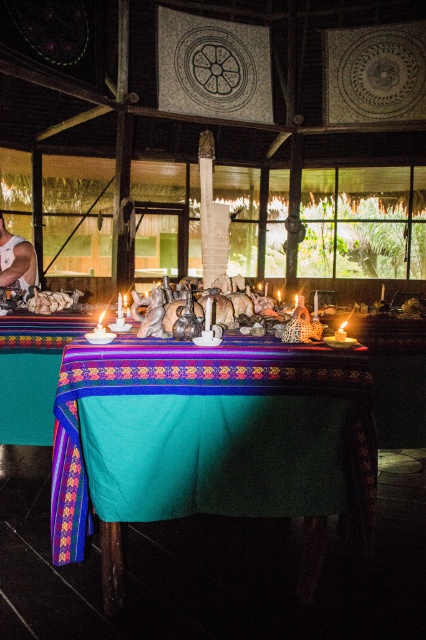
Is teal fabric table at center positioned behind muscular skin torso at lower left?

No, teal fabric table at center is closer to the viewer.

Between point (244, 419) and point (28, 273), which one is positioned behind?

The point (28, 273) is more distant.

Where is `teal fabric table at center`? The height and width of the screenshot is (640, 426). teal fabric table at center is located at coordinates (212, 438).